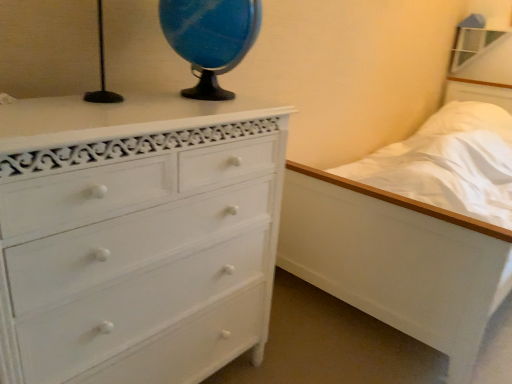
Question: Considering their positions, is white painted wood chest of drawers at left located in front of or behind white wooden bed at right?

Choices:
 (A) front
 (B) behind

Answer: (A)

Question: Considering the positions of white painted wood chest of drawers at left and white wooden bed at right in the image, is white painted wood chest of drawers at left wider or thinner than white wooden bed at right?

Choices:
 (A) wide
 (B) thin

Answer: (B)

Question: Which object is positioned closest to the white wooden bed at right?

Choices:
 (A) blue marble globe at upper center
 (B) white painted wood chest of drawers at left

Answer: (B)

Question: Which object is the farthest from the blue marble globe at upper center?

Choices:
 (A) white painted wood chest of drawers at left
 (B) white wooden bed at right

Answer: (B)